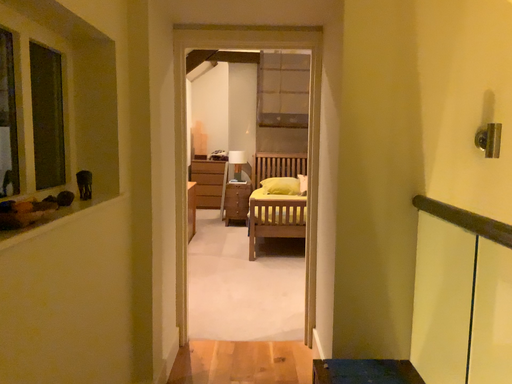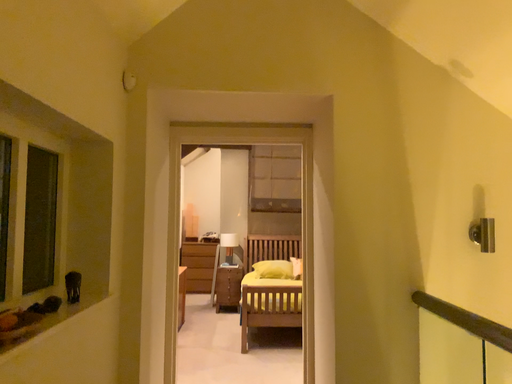
Question: How did the camera likely rotate when shooting the video?

Choices:
 (A) rotated downward
 (B) rotated upward

Answer: (B)